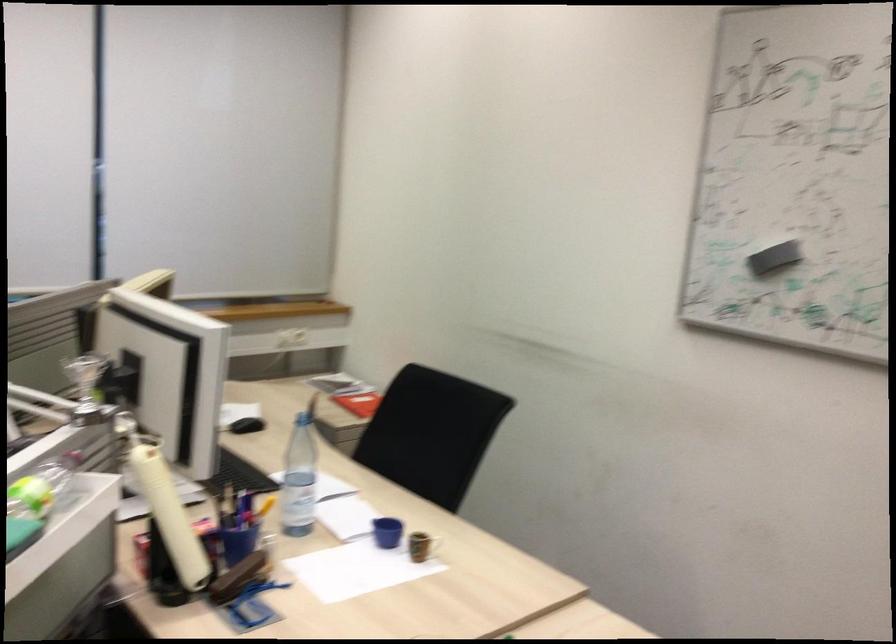
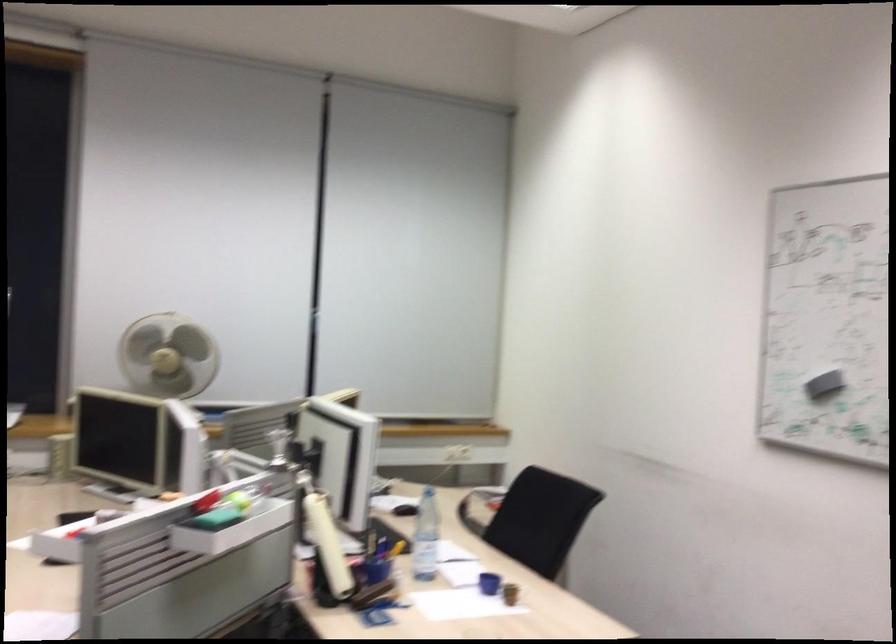
Locate, in the second image, the point that corresponds to point (423, 435) in the first image.

(531, 518)